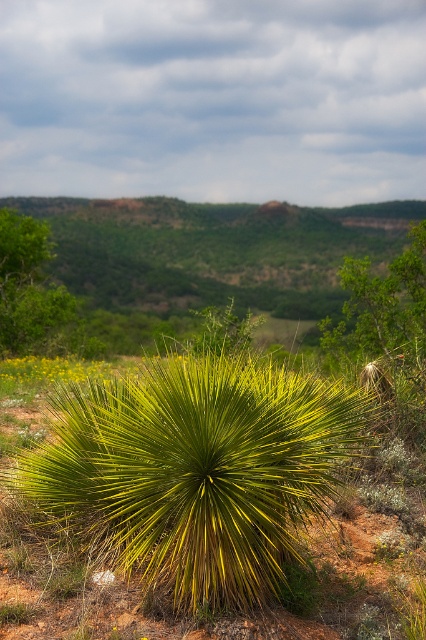
Does green spiky plant at center have a lesser height compared to green leafy tree at left?

Correct, green spiky plant at center is not as tall as green leafy tree at left.

Which of these two, green spiky plant at center or green leafy tree at left, stands taller?

With more height is green leafy tree at left.

Locate an element on the screen. This screenshot has height=640, width=426. green spiky plant at center is located at coordinates (195, 472).

Locate an element on the screen. green spiky plant at center is located at coordinates (195, 472).

Is green leafy tree at center above green leafy tree at left?

Actually, green leafy tree at center is below green leafy tree at left.

Is point (397, 280) in front of point (34, 252)?

Yes, point (397, 280) is in front of point (34, 252).

In order to click on green leafy tree at center in this screenshot , I will do `click(380, 308)`.

Is point (109, 428) closer to viewer compared to point (350, 289)?

Yes, point (109, 428) is closer to viewer.

Does green spiky plant at center appear over green leafy tree at center?

Actually, green spiky plant at center is below green leafy tree at center.

Who is more distant from viewer, (233,577) or (399,298)?

The point (399,298) is behind.

Where is `green spiky plant at center`? green spiky plant at center is located at coordinates (195, 472).